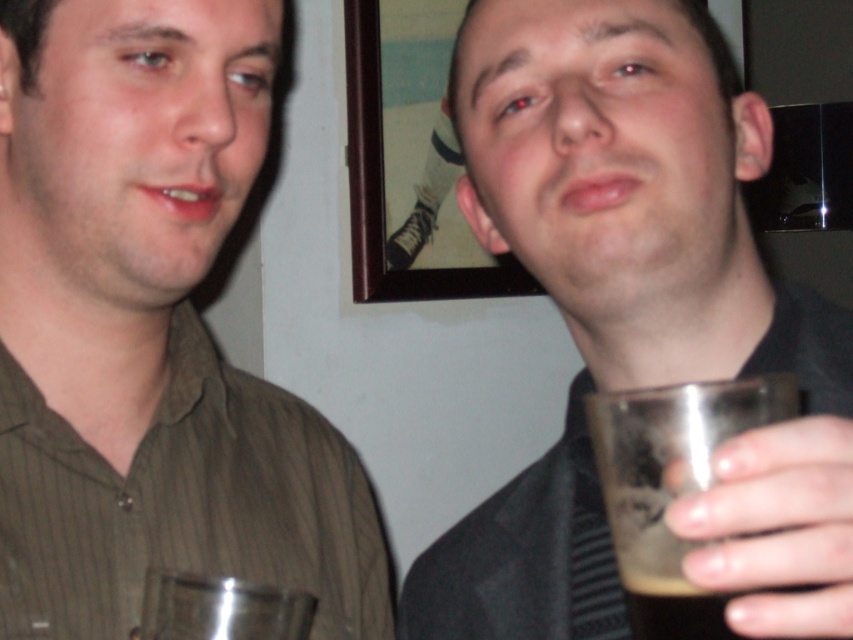
Question: Is matte brown shirt at left above clear plastic cup at upper right?

Choices:
 (A) yes
 (B) no

Answer: (B)

Question: Which of these objects is positioned closest to the clear plastic cup at upper right?

Choices:
 (A) matte brown shirt at left
 (B) translucent glass at right

Answer: (B)

Question: Which point appears farthest from the camera in this image?

Choices:
 (A) (138, 380)
 (B) (730, 403)

Answer: (A)

Question: Does matte brown shirt at left have a smaller size compared to translucent glass at right?

Choices:
 (A) yes
 (B) no

Answer: (B)

Question: Is clear plastic cup at upper right in front of translucent glass at right?

Choices:
 (A) no
 (B) yes

Answer: (B)

Question: Which point is closer to the camera taking this photo?

Choices:
 (A) (550, 220)
 (B) (634, 474)

Answer: (B)